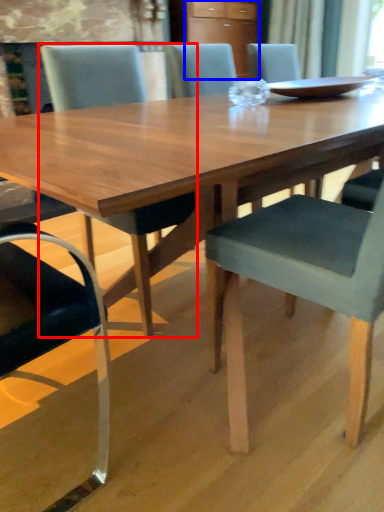
Question: Which point is closer to the camera, chair (highlighted by a red box) or cabinetry (highlighted by a blue box)?

Choices:
 (A) chair
 (B) cabinetry

Answer: (A)